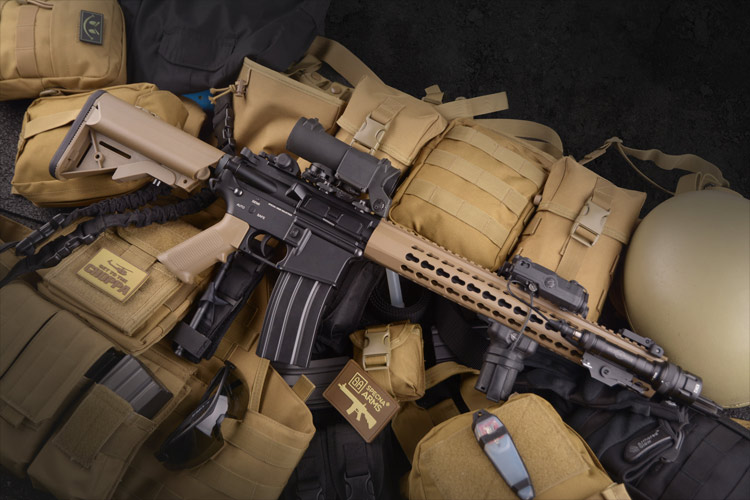
Identify the location of yellow frame. (391, 240).